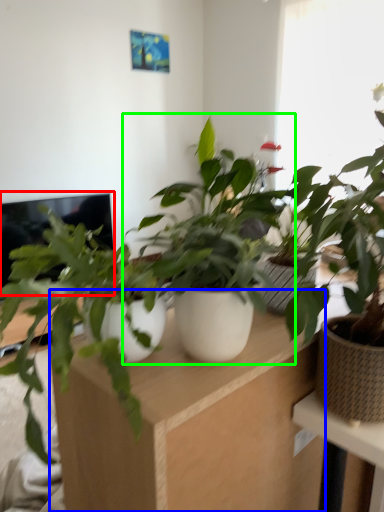
Question: Which is nearer to the computer screen (highlighted by a red box)? computer desk (highlighted by a blue box) or houseplant (highlighted by a green box).

Choices:
 (A) computer desk
 (B) houseplant

Answer: (B)